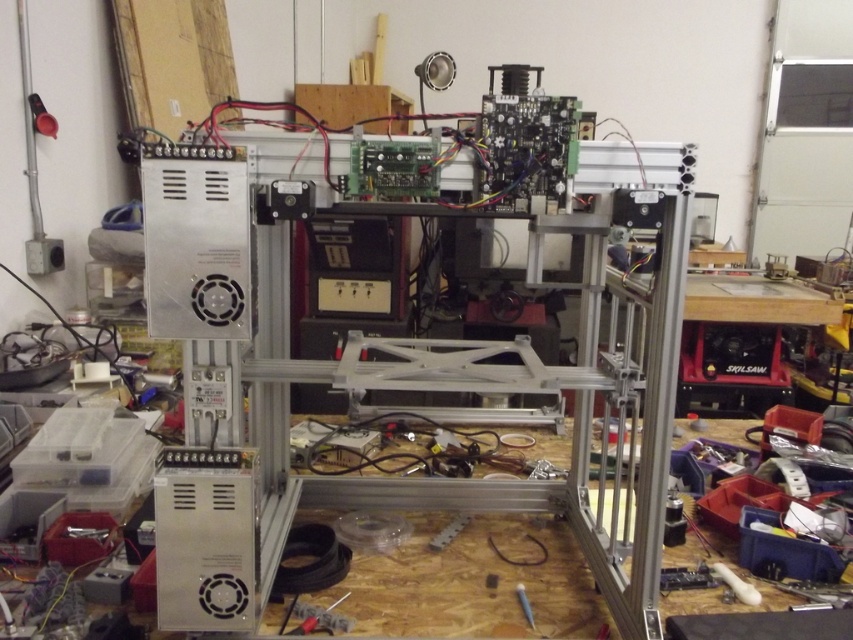
You are working on assembling a 3D printer and need to reach for both the white plastic tool at lower right and the metallic silver screwdriver at center. If your hand can only reach 12 inches, will you be able to grab both items without moving your hand?

The white plastic tool at lower right and the metallic silver screwdriver at center are 11.65 inches apart, so yes, you can grab both items without moving your hand since the distance is within your 12 inch reach.